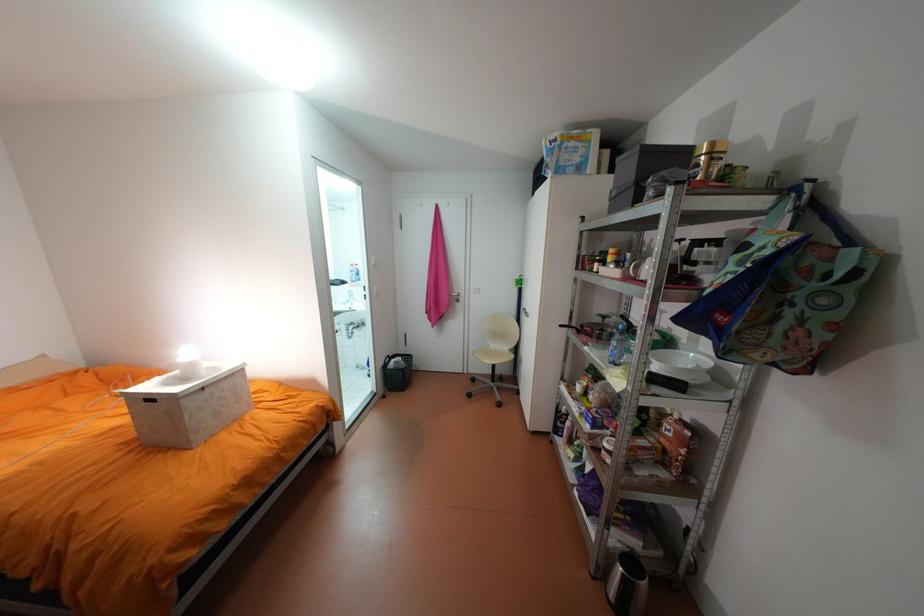
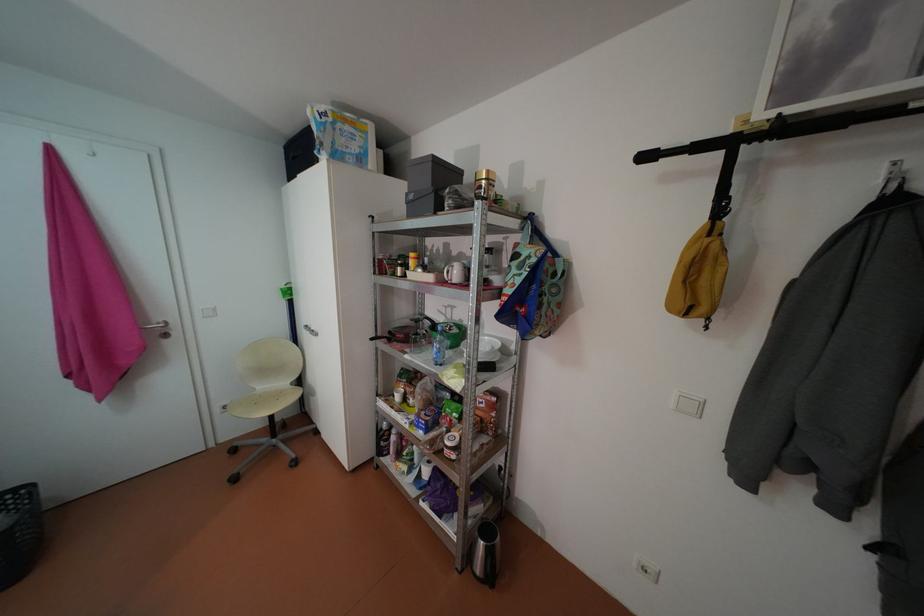
Question: The camera is either moving clockwise (left) or counter-clockwise (right) around the object. The first image is from the beginning of the video and the second image is from the end. Is the camera moving left or right when shooting the video?

Choices:
 (A) Left
 (B) Right

Answer: (A)